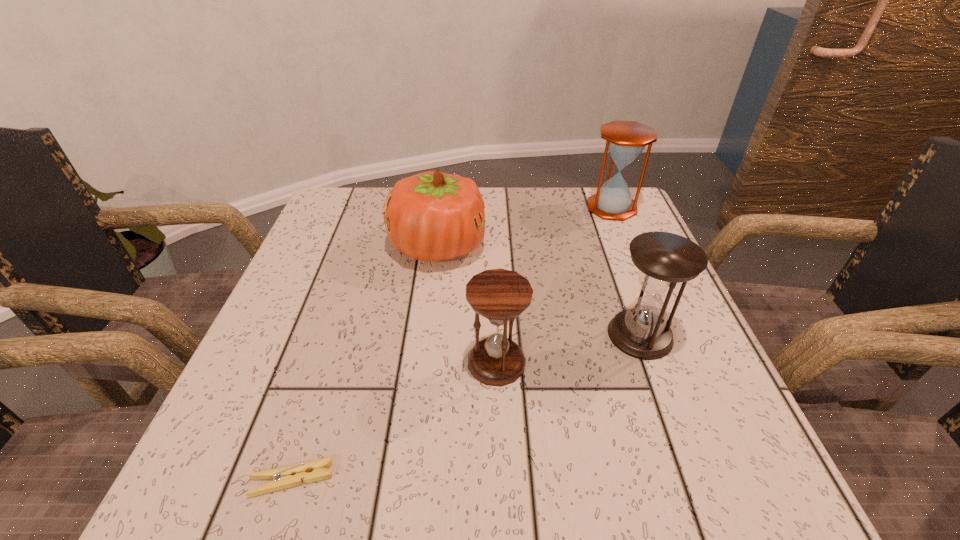
This screenshot has width=960, height=540. I want to click on free region at the far right corner of the desktop, so tap(591, 227).

The width and height of the screenshot is (960, 540). In order to click on vacant region at the near right corner of the desktop in this screenshot , I will do `click(730, 471)`.

At what (x,y) coordinates should I click in order to perform the action: click on vacant point located between the nearest object and the leftmost hourglass. Please return your answer as a coordinate pair (x, y). Looking at the image, I should click on (395, 421).

You are a GUI agent. You are given a task and a screenshot of the screen. Output one action in this format:
    pyautogui.click(x=<x>, y=<y>)
    Task: Click on the vacant space that is in between the clothespin and the pumpkin
    Image resolution: width=960 pixels, height=540 pixels.
    Given the screenshot: What is the action you would take?
    365,362

This screenshot has width=960, height=540. I want to click on free point between the pumpkin and the shortest object, so click(x=365, y=362).

Identify the location of vacant area that lies between the leftmost hourglass and the pumpkin. (468, 304).

At what (x,y) coordinates should I click in order to perform the action: click on empty space between the farthest hourglass and the leftmost hourglass. Please return your answer as a coordinate pair (x, y). Looking at the image, I should click on (554, 285).

Where is `vacant space in between the pumpkin and the shortest object`? The height and width of the screenshot is (540, 960). vacant space in between the pumpkin and the shortest object is located at coordinates (365, 362).

Identify the location of vacant space that is in between the clothespin and the leftmost hourglass. This screenshot has width=960, height=540. (395, 421).

Select which object is the second closest to the leftmost hourglass. Please provide its 2D coordinates. Your answer should be formatted as a tuple, i.e. [(x, y)], where the tuple contains the x and y coordinates of a point satisfying the conditions above.

[(432, 216)]